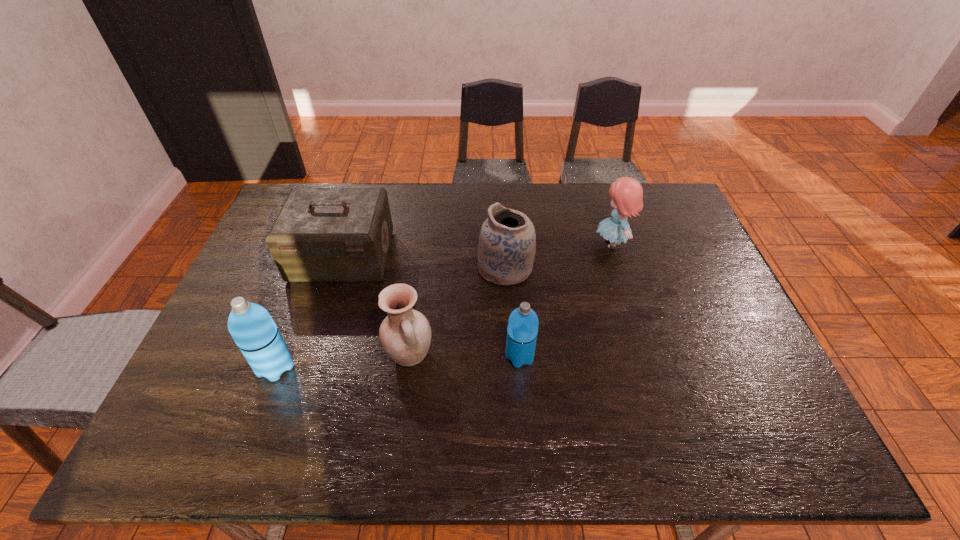
Identify the location of vacant space located 0.190m on the front-facing side of the rightmost object. The image size is (960, 540). (534, 244).

Find the location of a particular element. Image resolution: width=960 pixels, height=540 pixels. free space located 0.240m on the front-facing side of the rightmost object is located at coordinates (518, 244).

You are a GUI agent. You are given a task and a screenshot of the screen. Output one action in this format:
    pyautogui.click(x=<x>, y=<y>)
    Task: Click on the free space located on the right of the first-aid kit
    
    Given the screenshot: What is the action you would take?
    pyautogui.click(x=415, y=256)

This screenshot has width=960, height=540. Identify the location of vacant space located 0.180m on the left of the fourth object from right to left. (314, 356).

I want to click on blank area located 0.290m on the back of the right pottery, so click(501, 195).

This screenshot has width=960, height=540. What are the coordinates of `object positioned at the far edge` in the screenshot? It's located at (626, 193).

In order to click on thermos bottle present at the near edge in this screenshot , I will do `click(251, 326)`.

At what (x,y) coordinates should I click in order to perform the action: click on pottery at the near edge. Please return your answer as a coordinate pair (x, y). Looking at the image, I should click on (405, 334).

Locate an element on the screen. Image resolution: width=960 pixels, height=540 pixels. thermos bottle at the left edge is located at coordinates (251, 326).

The height and width of the screenshot is (540, 960). Identify the location of the first-aid kit positioned at the left edge. (321, 234).